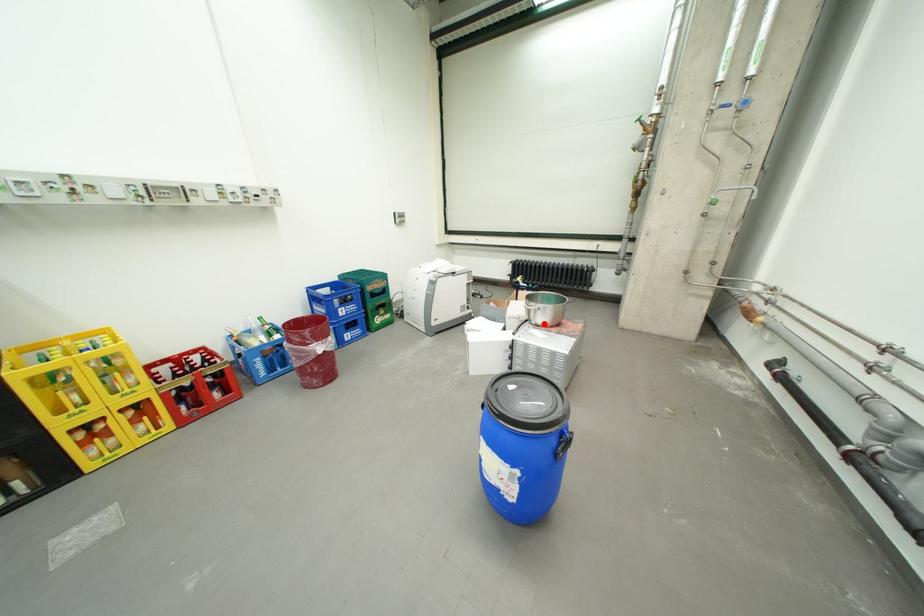
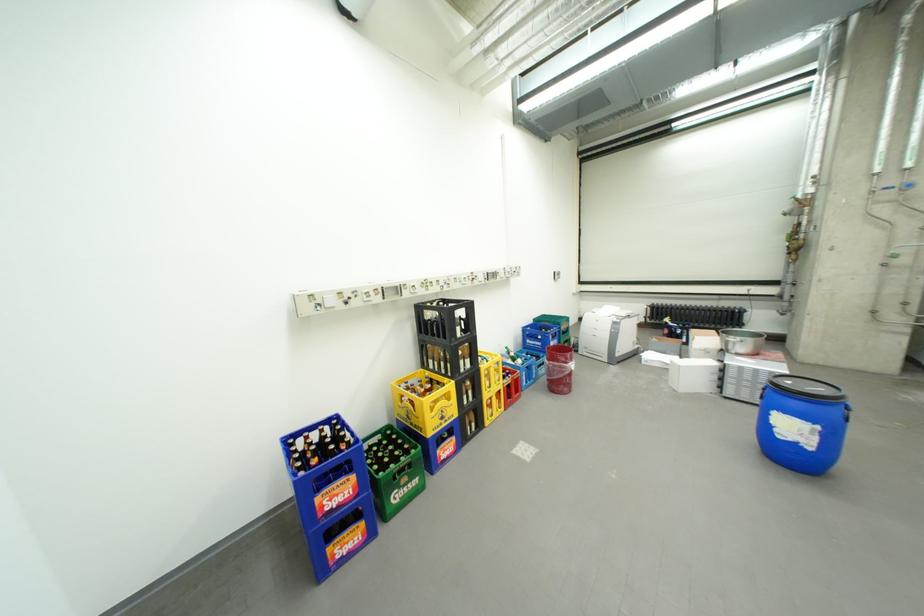
Question: I am providing you with two images of the same scene from different viewpoints. A red point is marked on the first image. At the location where the point appears in image 1, is it still visible in image 2?

Choices:
 (A) Yes
 (B) No

Answer: (A)